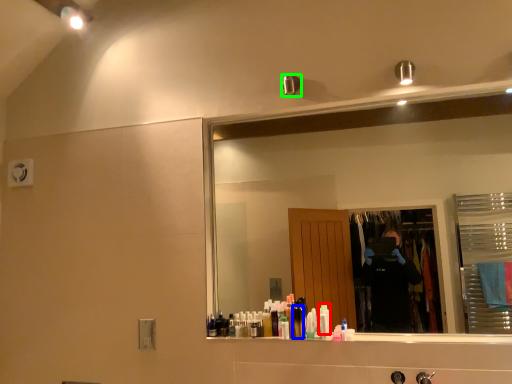
Question: Considering the real-world distances, which object is closest to toiletry (highlighted by a red box)? toiletry (highlighted by a blue box) or shower (highlighted by a green box).

Choices:
 (A) toiletry
 (B) shower

Answer: (A)